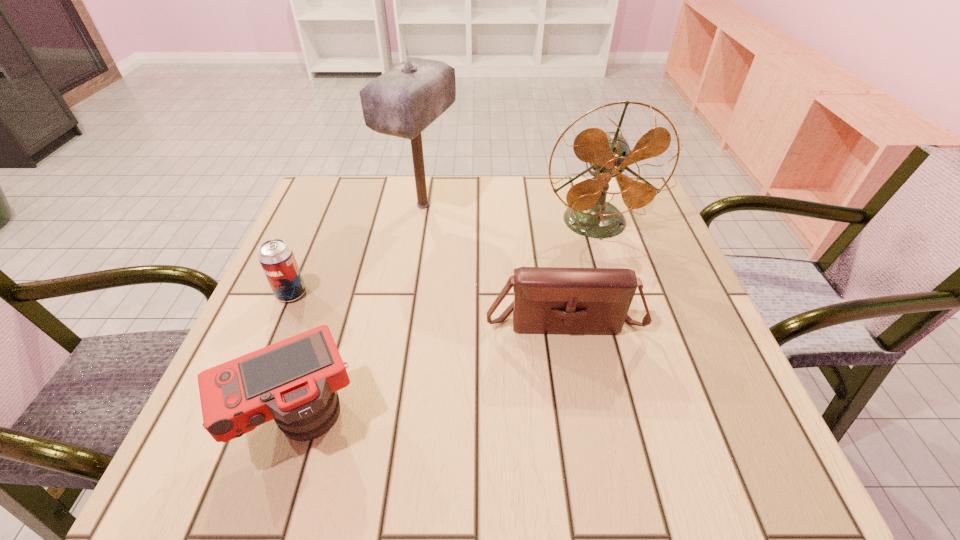
Identify the location of vacant region at the left edge. (317, 232).

This screenshot has width=960, height=540. I want to click on blank space at the right edge, so click(685, 348).

I want to click on free space at the far left corner of the desktop, so click(319, 195).

You are a GUI agent. You are given a task and a screenshot of the screen. Output one action in this format:
    pyautogui.click(x=<x>, y=<y>)
    Task: Click on the free space at the far right corner of the desktop
    Image resolution: width=960 pixels, height=540 pixels.
    Given the screenshot: What is the action you would take?
    pyautogui.click(x=630, y=213)

Find the location of a particular element. The height and width of the screenshot is (540, 960). free space at the near right corner of the desktop is located at coordinates (725, 478).

At what (x,y) coordinates should I click in order to perform the action: click on vacant area that lies between the mallet and the beer can. Please return your answer as a coordinate pair (x, y). This screenshot has height=540, width=960. Looking at the image, I should click on (357, 249).

The width and height of the screenshot is (960, 540). What are the coordinates of `vacant area that lies between the mallet and the beer can` in the screenshot? It's located at (357, 249).

Identify the location of empty space between the shoulder bag and the nearest object. The height and width of the screenshot is (540, 960). (431, 369).

Where is `empty space between the mallet and the beer can`? The height and width of the screenshot is (540, 960). empty space between the mallet and the beer can is located at coordinates (357, 249).

What are the coordinates of `empty space that is in between the second tallest object and the mallet` in the screenshot? It's located at (509, 214).